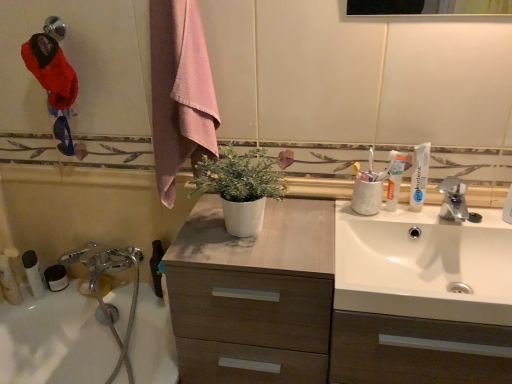
Where is `vacant area that lies between white matte pot at center and silver metallic faucet at upper right`? This screenshot has height=384, width=512. vacant area that lies between white matte pot at center and silver metallic faucet at upper right is located at coordinates (338, 229).